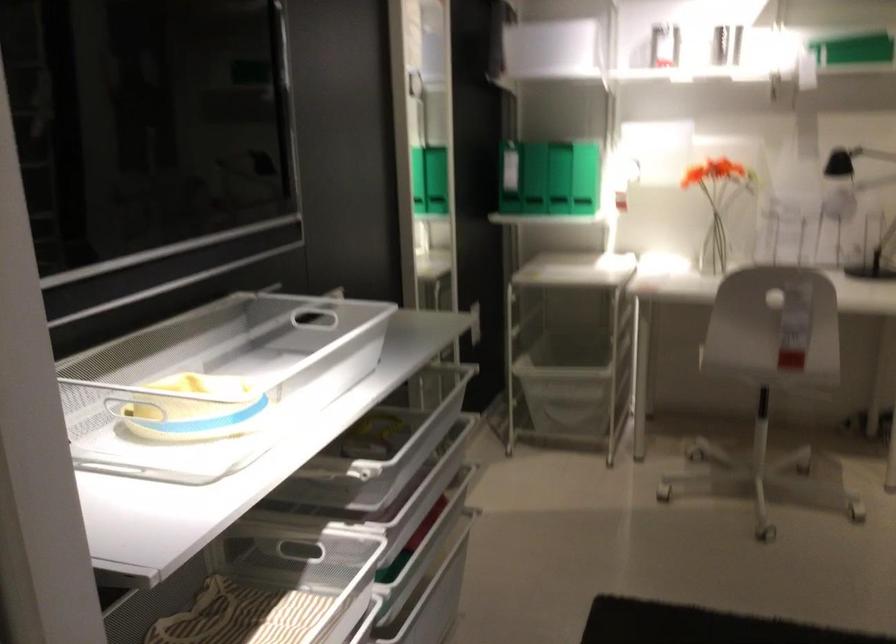
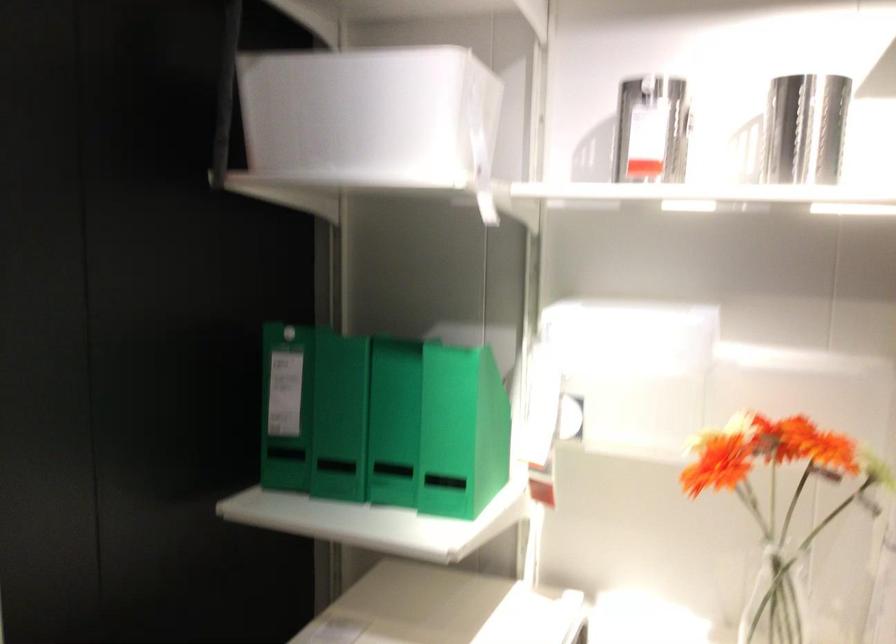
Locate, in the second image, the point that corresponds to the point at 565,167 in the first image.

(392, 422)